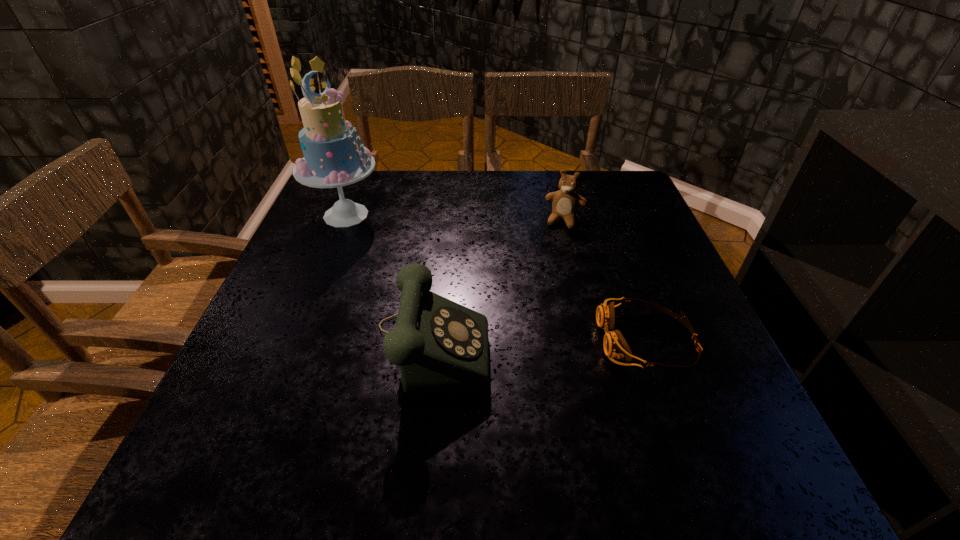
This screenshot has width=960, height=540. I want to click on free spot between the third shortest object and the shortest object, so [x=540, y=339].

Where is `vacant point located between the cake and the second shortest object`? The width and height of the screenshot is (960, 540). vacant point located between the cake and the second shortest object is located at coordinates (456, 218).

Identify the location of vacant region between the goggles and the cake. 496,278.

Identify the location of unoccupied area between the second shortest object and the tallest object. (456, 218).

This screenshot has height=540, width=960. I want to click on vacant area that lies between the second tallest object and the shortest object, so click(x=540, y=339).

Image resolution: width=960 pixels, height=540 pixels. What are the coordinates of `free spot between the teddy bear and the goggles` in the screenshot? It's located at (606, 280).

I want to click on unoccupied position between the telephone and the tallest object, so click(x=389, y=276).

Where is `free space between the leftmost object and the shortest object`? Image resolution: width=960 pixels, height=540 pixels. free space between the leftmost object and the shortest object is located at coordinates (496, 278).

Identify the location of object that is the second closest to the second tallest object. This screenshot has height=540, width=960. (615, 346).

Locate an element on the screen. This screenshot has height=540, width=960. object that ranks as the closest to the shortest object is located at coordinates tap(441, 347).